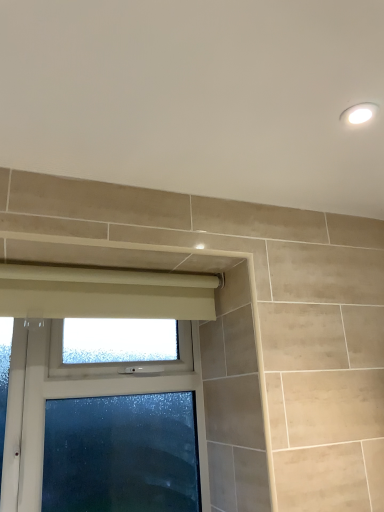
Question: Considering their positions, is white glossy light fixture at upper right located in front of or behind frosted glass window at lower left?

Choices:
 (A) front
 (B) behind

Answer: (A)

Question: Would you say white glossy light fixture at upper right is to the left or to the right of frosted glass window at lower left in the picture?

Choices:
 (A) left
 (B) right

Answer: (B)

Question: Estimate the real-world distances between objects in this image. Which object is closer to the frosted glass window at lower left?

Choices:
 (A) beige fabric curtain at upper center
 (B) white glossy light fixture at upper right

Answer: (A)

Question: Which is nearer to the beige fabric curtain at upper center?

Choices:
 (A) white glossy light fixture at upper right
 (B) frosted glass window at lower left

Answer: (B)